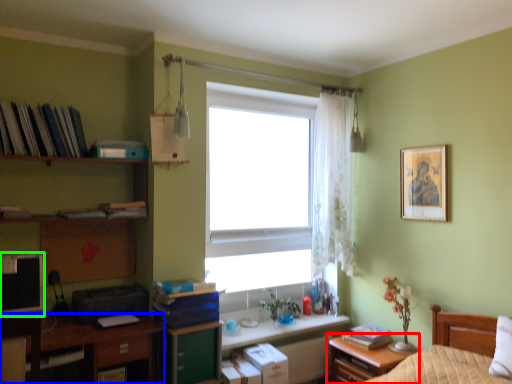
Question: Estimate the real-world distances between objects in this image. Which object is farther from nightstand (highlighted by a red box), desk (highlighted by a blue box) or computer monitor (highlighted by a green box)?

Choices:
 (A) desk
 (B) computer monitor

Answer: (B)